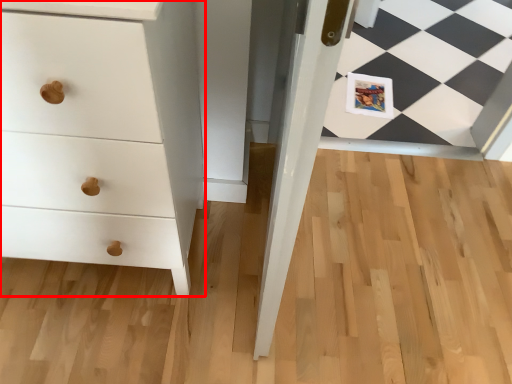
Question: Observing the image, what is the correct spatial positioning of chest of drawers (annotated by the red box) in reference to postcard?

Choices:
 (A) left
 (B) right

Answer: (A)